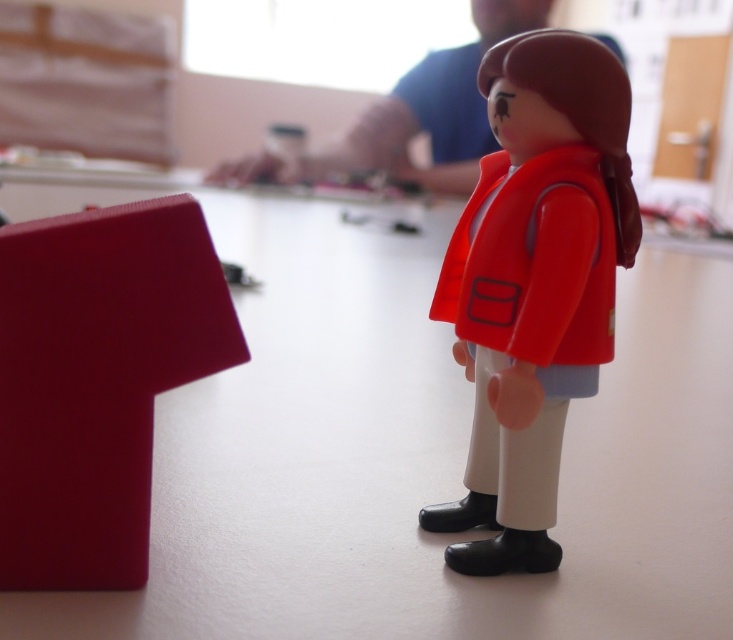
You are trying to reach the matte plastic figure at upper center from where you are standing. Is the matte plastic doll at center blocking your view of it?

The matte plastic doll at center is closer to the viewer than the matte plastic figure at upper center, so it may partially block the view depending on the angle, but since the figure is at upper center, it might still be visible above the doll.

You are a delivery robot that needs to place a package between the matte plastic doll at center and the matte plastic figure at upper center. The package requires a minimum of 6 feet of space. Can you fit the package between them?

The matte plastic doll at center is 5.85 feet from the matte plastic figure at upper center, so the package requiring 6 feet of space cannot fit between them as the available space is slightly less than required.

You are a child trying to reach the matte plastic figure at upper center on the table where the matte plastic doll at center is located. Can you reach it without moving the doll?

The matte plastic doll at center is positioned under the matte plastic figure at upper center, so yes, you can reach the matte plastic figure at upper center without moving the doll since it is above it.